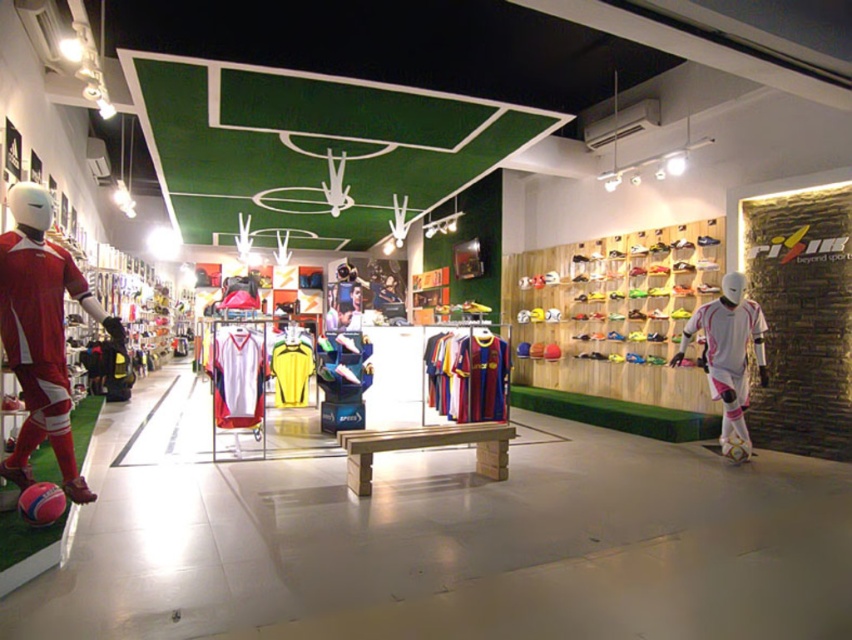
Which is above, matte red soccer uniform at left or white matte soccer player at right?

matte red soccer uniform at left

Who is shorter, matte red soccer uniform at left or white matte soccer player at right?

Standing shorter between the two is white matte soccer player at right.

Is point (114, 330) farther from viewer compared to point (728, 339)?

No, (114, 330) is in front of (728, 339).

You are a GUI agent. You are given a task and a screenshot of the screen. Output one action in this format:
    pyautogui.click(x=<x>, y=<y>)
    Task: Click on the matte red soccer uniform at left
    The height and width of the screenshot is (640, 852).
    Given the screenshot: What is the action you would take?
    (x=39, y=333)